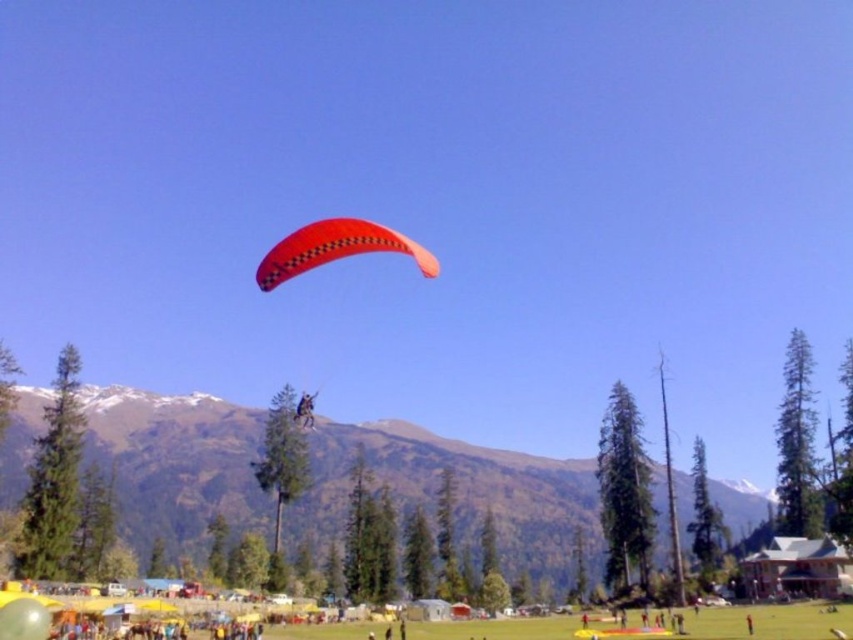
You are a photographer standing at the edge of the grassy field. You want to take a photo of the matte orange parachute at center and the leather jacket at center so that both are clearly visible in the frame. Given that your camera has a maximum focus range of 40 meters, will you be able to capture both subjects in focus?

The matte orange parachute at center and leather jacket at center are 38.80 meters apart. Since the camera can focus up to 40 meters, the distance between them is within the focus range, so both subjects can be captured in focus.

You are a photographer trying to capture the snowy rock mountain at upper center in your shot. According to the coordinates provided, where exactly should you position the mountain in your camera frame?

The snowy rock mountain at upper center should be positioned at coordinates point (460, 492) in your camera frame.

You are a photographer at the event setup in the foreground. You want to take a photo of the snowy rock mountain at upper center without the leather jacket at center blocking the view. Is it possible?

The snowy rock mountain at upper center is located below the leather jacket at center, so the leather jacket at center is above it. Therefore, the leather jacket at center would block the view of the snowy rock mountain at upper center, making it impossible to take a clear photo without obstruction.